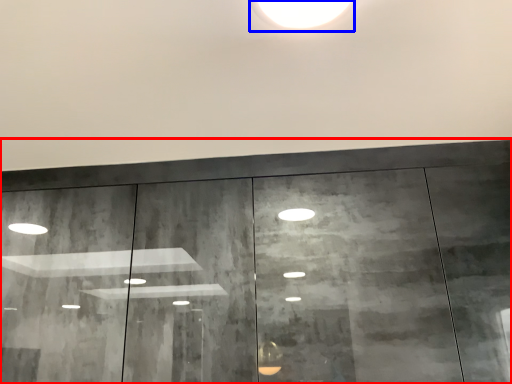
Question: Which object is closer to the camera taking this photo, door (highlighted by a red box) or light (highlighted by a blue box)?

Choices:
 (A) door
 (B) light

Answer: (B)